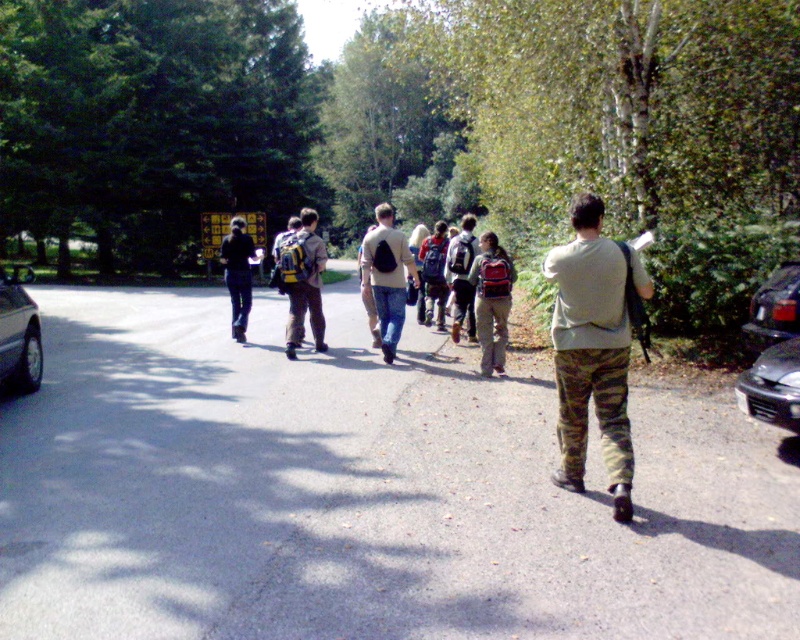
Is camo fabric pants at center smaller than matte yellow backpack at center?

Correct, camo fabric pants at center occupies less space than matte yellow backpack at center.

Does point (598, 388) come in front of point (298, 316)?

Yes, point (598, 388) is closer to viewer.

The width and height of the screenshot is (800, 640). I want to click on camo fabric pants at center, so click(x=594, y=410).

Is point (417, 280) positioned in front of point (490, 371)?

No, (417, 280) is further to viewer.

Which is behind, point (400, 282) or point (494, 280)?

The point (400, 282) is behind.

You are a GUI agent. You are given a task and a screenshot of the screen. Output one action in this format:
    pyautogui.click(x=<x>, y=<y>)
    Task: Click on the matte beige sweater at center
    This screenshot has width=800, height=640.
    Given the screenshot: What is the action you would take?
    pyautogui.click(x=386, y=275)

Find the location of `matte beige sweater at center`. matte beige sweater at center is located at coordinates (386, 275).

Is the position of asphalt road at center more distant than that of black matte car at right?

That is False.

Locate an element on the screen. asphalt road at center is located at coordinates (362, 493).